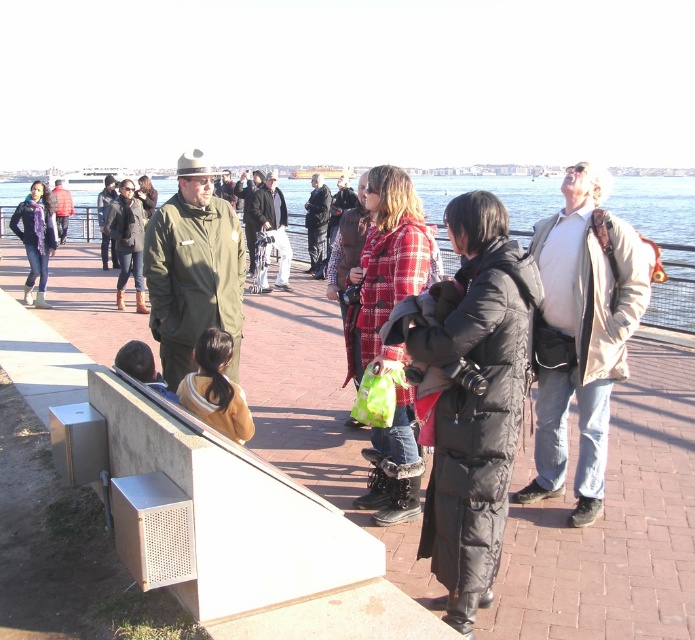
You are a photographer trying to capture a photo of the waterfront scene. You need to ensure that the light brown leather jacket at upper right is centered in the frame. Given that your camera has a 1280x720 resolution, what are the pixel coordinates where you should position the center of the jacket?

The light brown leather jacket at upper right is located at point coordinates of [582,333]. To convert this to pixel coordinates on a 1280x720 resolution, multiply the x value by 1280 and the y value by 720. This gives the center position at approximately 655 pixels horizontally and 607 pixels vertically.

You are a photographer trying to capture a group photo of the black puffy coat at center and the dark gray uniform at center. To ensure both subjects are in the frame, should you adjust your camera to focus more to the left or the right?

The black puffy coat at center is positioned on the right side of dark gray uniform at center, so you should adjust your camera to focus more to the right to include both subjects in the frame.

You are a photographer standing at the edge of the walkway, and you want to take a photo that includes both the black puffy coat at center and the dark gray uniform at center. Given that your camera has a maximum focus range of 8 meters, will you be able to capture both subjects in focus?

The black puffy coat at center and dark gray uniform at center are 8.86 meters apart. Since your camera can only focus up to 8 meters, the distance between them exceeds the focus range. Therefore, you won